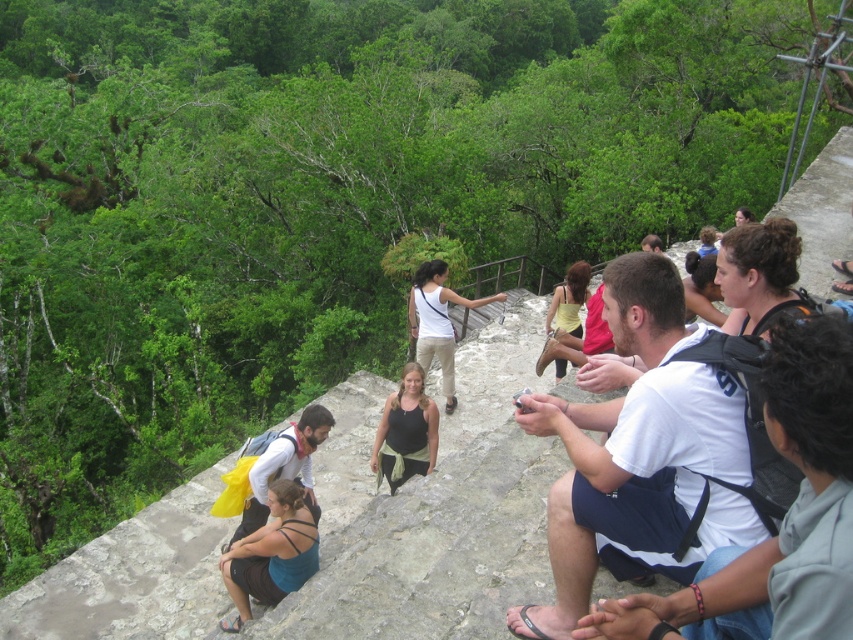
You are standing on the stone structure overlooking the forest. There are two points marked on the stone surface. One is at coordinate point (258, 602) and the other at point (271, 461). Which point is closer to you if you are facing the forest?

Point (258, 602) is in front of point (271, 461), so if you are facing the forest, point (258, 602) would be closer to you.

You are a photographer positioned at the edge of the stone structure. You want to capture a photo that includes both the brown hair at upper right and the yellow fabric dress at center. Which object should you adjust your camera angle to focus on first to ensure both are in frame?

The brown hair at upper right is located below the yellow fabric dress at center, so you should focus on the yellow fabric dress at center first to ensure the brown hair at upper right remains in the frame below it.

You are a photographer trying to capture a photo of the dark blue backpack at center without the teal fabric tank top at lower left appearing in the foreground. Based on their heights, can you position yourself so that the backpack is fully visible without the tank top blocking it?

The teal fabric tank top at lower left is shorter than the dark blue backpack at center, so positioning yourself at a lower angle or moving closer to the backpack would allow the backpack to be fully visible without the tank top blocking it since the tank top is shorter and might be positioned behind or beside it depending on their arrangement.